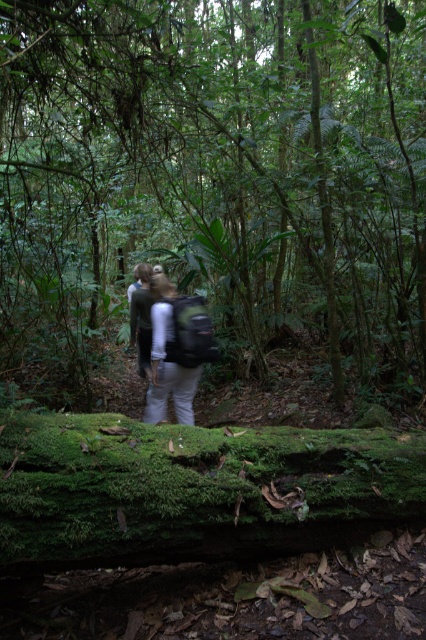
Question: Which point is farther to the camera?

Choices:
 (A) green mossy log at lower center
 (B) light gray fabric backpack at center

Answer: (B)

Question: Considering the relative positions of green mossy log at lower center and light gray fabric backpack at center in the image provided, where is green mossy log at lower center located with respect to light gray fabric backpack at center?

Choices:
 (A) right
 (B) left

Answer: (A)

Question: In this image, where is green mossy log at lower center located relative to light gray fabric backpack at center?

Choices:
 (A) above
 (B) below

Answer: (A)

Question: Is green mossy log at lower center smaller than light gray fabric backpack at center?

Choices:
 (A) no
 (B) yes

Answer: (A)